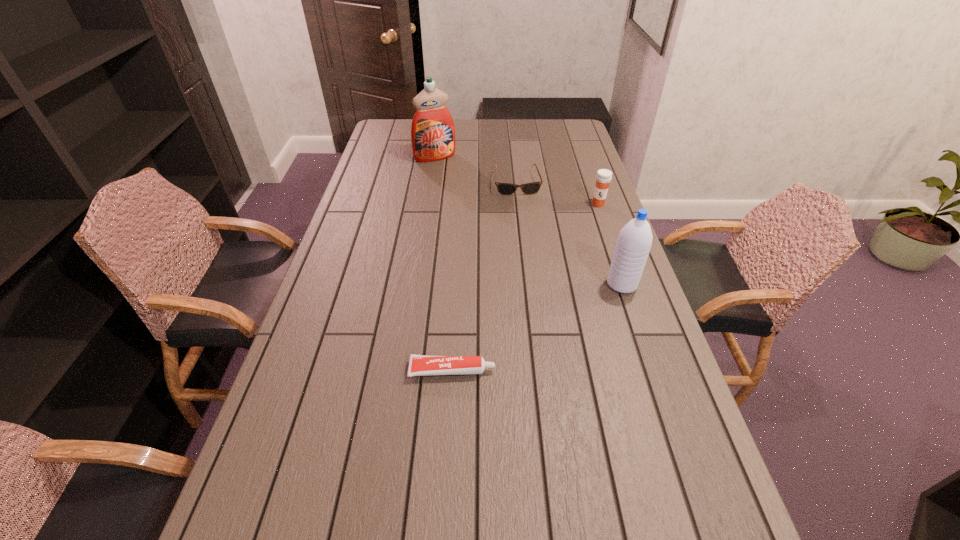
I want to click on vacant space located 0.160m on the front surface of the farthest object, so [x=456, y=182].

Identify the location of water bottle that is at the right edge. The width and height of the screenshot is (960, 540). (634, 242).

You are a GUI agent. You are given a task and a screenshot of the screen. Output one action in this format:
    pyautogui.click(x=<x>, y=<y>)
    Task: Click on the medicine that is at the right edge
    
    Given the screenshot: What is the action you would take?
    pyautogui.click(x=603, y=178)

In the image, there is a desktop. Where is `blank space at the left edge`? blank space at the left edge is located at coordinates (350, 321).

Identify the location of vacant space at the right edge of the desktop. This screenshot has width=960, height=540. (x=593, y=179).

What are the coordinates of `free space between the nearest object and the water bottle` in the screenshot? It's located at (537, 327).

This screenshot has height=540, width=960. I want to click on vacant area that lies between the detergent and the shortest object, so click(x=444, y=264).

I want to click on vacant space that's between the detergent and the toothpaste, so click(444, 264).

At what (x,y) coordinates should I click in order to perform the action: click on free space that is in between the detergent and the fourth nearest object. Please return your answer as a coordinate pair (x, y). Looking at the image, I should click on tap(476, 170).

This screenshot has height=540, width=960. What are the coordinates of `vacant space in between the water bottle and the third farthest object` in the screenshot? It's located at (610, 244).